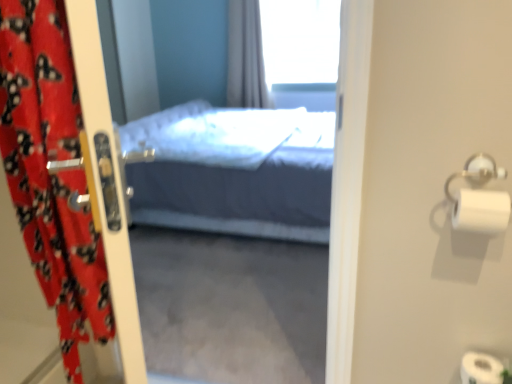
Question: Is red fabric curtain at left wider than transparent glass window at upper center?

Choices:
 (A) no
 (B) yes

Answer: (A)

Question: Is red fabric curtain at left closer to the viewer compared to transparent glass window at upper center?

Choices:
 (A) no
 (B) yes

Answer: (B)

Question: Is red fabric curtain at left smaller than transparent glass window at upper center?

Choices:
 (A) no
 (B) yes

Answer: (B)

Question: Considering the relative sizes of red fabric curtain at left and transparent glass window at upper center in the image provided, is red fabric curtain at left bigger than transparent glass window at upper center?

Choices:
 (A) yes
 (B) no

Answer: (B)

Question: Is red fabric curtain at left at the left side of transparent glass window at upper center?

Choices:
 (A) no
 (B) yes

Answer: (B)

Question: Is silver metallic towel bar at right taller or shorter than transparent glass window at upper center?

Choices:
 (A) tall
 (B) short

Answer: (B)

Question: Considering their positions, is silver metallic towel bar at right located in front of or behind transparent glass window at upper center?

Choices:
 (A) front
 (B) behind

Answer: (A)

Question: Based on their positions, is silver metallic towel bar at right located to the left or right of transparent glass window at upper center?

Choices:
 (A) left
 (B) right

Answer: (B)

Question: From a real-world perspective, is silver metallic towel bar at right positioned above or below transparent glass window at upper center?

Choices:
 (A) above
 (B) below

Answer: (B)

Question: In terms of width, does white matte toilet paper at right look wider or thinner when compared to transparent glass window at upper center?

Choices:
 (A) wide
 (B) thin

Answer: (B)

Question: Based on their positions, is white matte toilet paper at right located to the left or right of transparent glass window at upper center?

Choices:
 (A) left
 (B) right

Answer: (B)

Question: From their relative heights in the image, would you say white matte toilet paper at right is taller or shorter than transparent glass window at upper center?

Choices:
 (A) short
 (B) tall

Answer: (A)

Question: From a real-world perspective, is white matte toilet paper at right positioned above or below transparent glass window at upper center?

Choices:
 (A) above
 (B) below

Answer: (B)

Question: In terms of height, does red fabric curtain at left look taller or shorter compared to silver metallic towel bar at right?

Choices:
 (A) tall
 (B) short

Answer: (A)

Question: From a real-world perspective, is red fabric curtain at left physically located above or below silver metallic towel bar at right?

Choices:
 (A) below
 (B) above

Answer: (A)